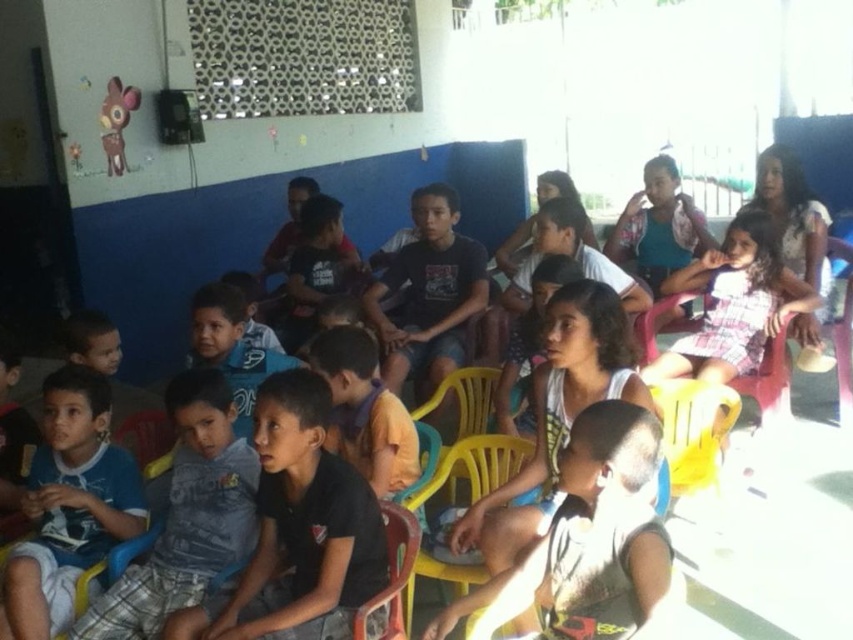
Question: Can you confirm if blue cotton shirt at lower left is smaller than yellow plastic chair at center?

Choices:
 (A) yes
 (B) no

Answer: (B)

Question: Which point is farther to the camera?

Choices:
 (A) (27, 508)
 (B) (407, 518)

Answer: (A)

Question: Does blue cotton shirt at lower left appear under yellow plastic chair at center?

Choices:
 (A) yes
 (B) no

Answer: (B)

Question: Does blue cotton shirt at lower left have a greater width compared to yellow plastic chair at center?

Choices:
 (A) no
 (B) yes

Answer: (B)